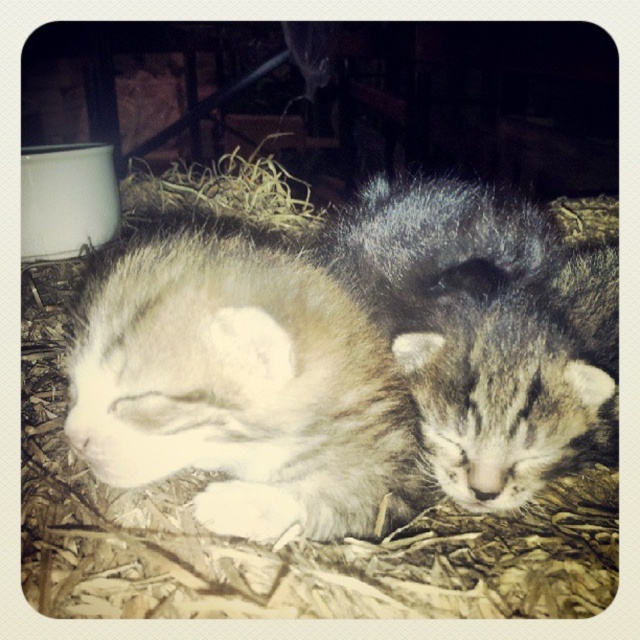
Find the location of a particular element. Image resolution: width=640 pixels, height=640 pixels. white fluffy cat at center is located at coordinates (241, 387).

Between white fluffy cat at center and fuzzy brown cat at center, which one is positioned lower?

white fluffy cat at center

The height and width of the screenshot is (640, 640). What do you see at coordinates (241, 387) in the screenshot? I see `white fluffy cat at center` at bounding box center [241, 387].

At what (x,y) coordinates should I click in order to perform the action: click on white fluffy cat at center. Please return your answer as a coordinate pair (x, y). This screenshot has width=640, height=640. Looking at the image, I should click on (241, 387).

Does point (522, 452) come closer to viewer compared to point (225, 216)?

Yes, it is in front of point (225, 216).

Between point (572, 312) and point (134, 173), which one is positioned behind?

Positioned behind is point (134, 173).

Who is more distant from viewer, (x=598, y=374) or (x=227, y=154)?

The point (x=227, y=154) is more distant.

Locate an element on the screen. Image resolution: width=640 pixels, height=640 pixels. fuzzy brown cat at center is located at coordinates (486, 330).

Is point (209, 362) farther from camera compared to point (262, 205)?

No, (209, 362) is closer to viewer.

Can you confirm if white fluffy cat at center is positioned to the right of brown straw at upper center?

Yes, white fluffy cat at center is to the right of brown straw at upper center.

Is point (176, 257) farther from viewer compared to point (269, 225)?

That is False.

Identify the location of white fluffy cat at center. (241, 387).